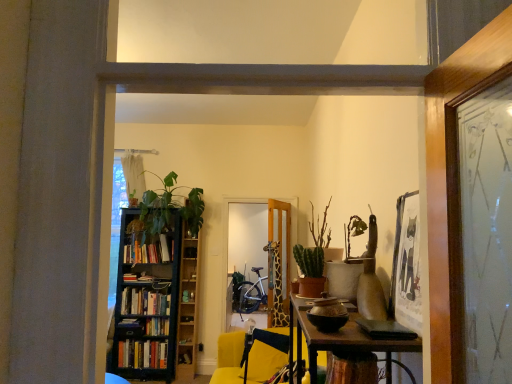
Question: From the image's perspective, is hardcover books at left, acting as the first book starting from the bottom, on green matte plant at center?

Choices:
 (A) yes
 (B) no

Answer: (B)

Question: Is hardcover books at left, acting as the fourth book starting from the top, directly adjacent to green matte plant at center?

Choices:
 (A) no
 (B) yes

Answer: (A)

Question: From a real-world perspective, is hardcover books at left, acting as the fourth book starting from the top, positioned under green matte plant at center based on gravity?

Choices:
 (A) no
 (B) yes

Answer: (B)

Question: Can you confirm if hardcover books at left, acting as the first book starting from the bottom, is wider than green matte plant at center?

Choices:
 (A) yes
 (B) no

Answer: (B)

Question: Is hardcover books at left, acting as the first book starting from the bottom, to the left of green matte plant at center from the viewer's perspective?

Choices:
 (A) yes
 (B) no

Answer: (A)

Question: Is green matte plant at center surrounded by hardcover books at left, acting as the first book starting from the bottom?

Choices:
 (A) no
 (B) yes

Answer: (A)

Question: Is wooden bookshelf at center-left positioned far away from yellow fabric chair at center?

Choices:
 (A) yes
 (B) no

Answer: (A)

Question: Does wooden bookshelf at center-left have a greater width compared to yellow fabric chair at center?

Choices:
 (A) yes
 (B) no

Answer: (B)

Question: Is wooden bookshelf at center-left oriented towards yellow fabric chair at center?

Choices:
 (A) yes
 (B) no

Answer: (B)

Question: Can you confirm if wooden bookshelf at center-left is shorter than yellow fabric chair at center?

Choices:
 (A) yes
 (B) no

Answer: (B)

Question: Is wooden bookshelf at center-left next to yellow fabric chair at center and touching it?

Choices:
 (A) yes
 (B) no

Answer: (B)

Question: Does wooden bookshelf at center-left appear on the left side of yellow fabric chair at center?

Choices:
 (A) yes
 (B) no

Answer: (A)

Question: Does hardcover books at left, which is counted as the third book, starting from the bottom, lie behind green matte plant at center?

Choices:
 (A) yes
 (B) no

Answer: (A)